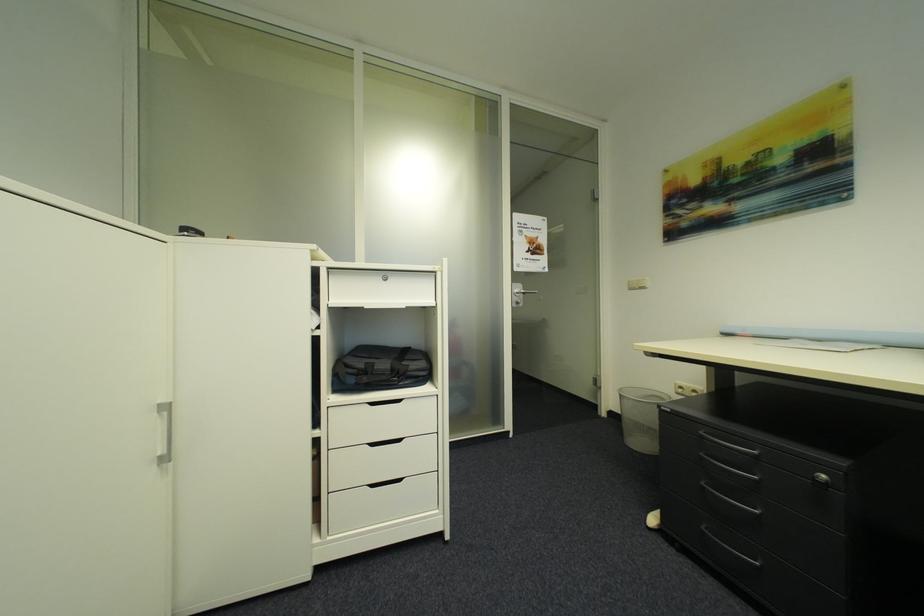
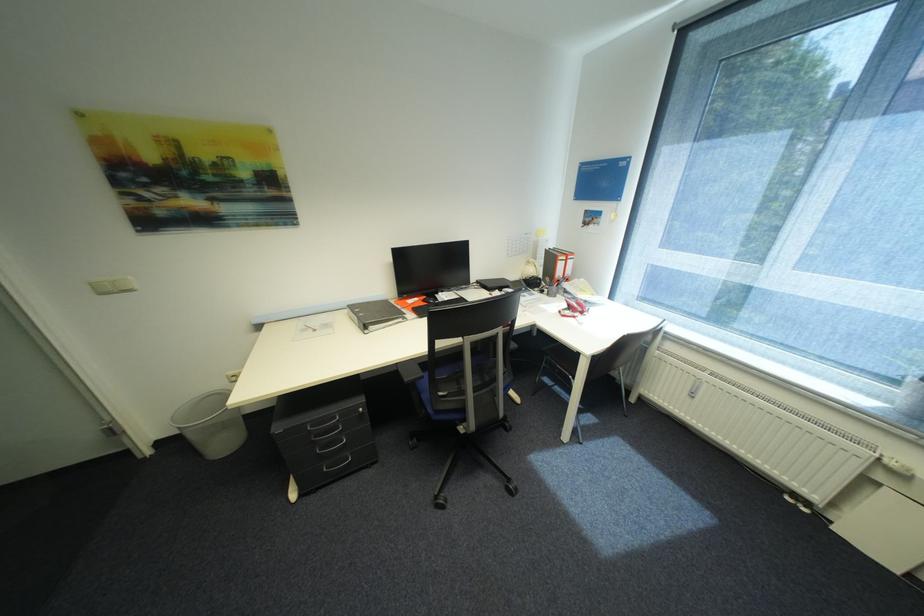
Based on the continuous images, in which direction is the camera rotating?

The rotation direction of the camera is right-down.